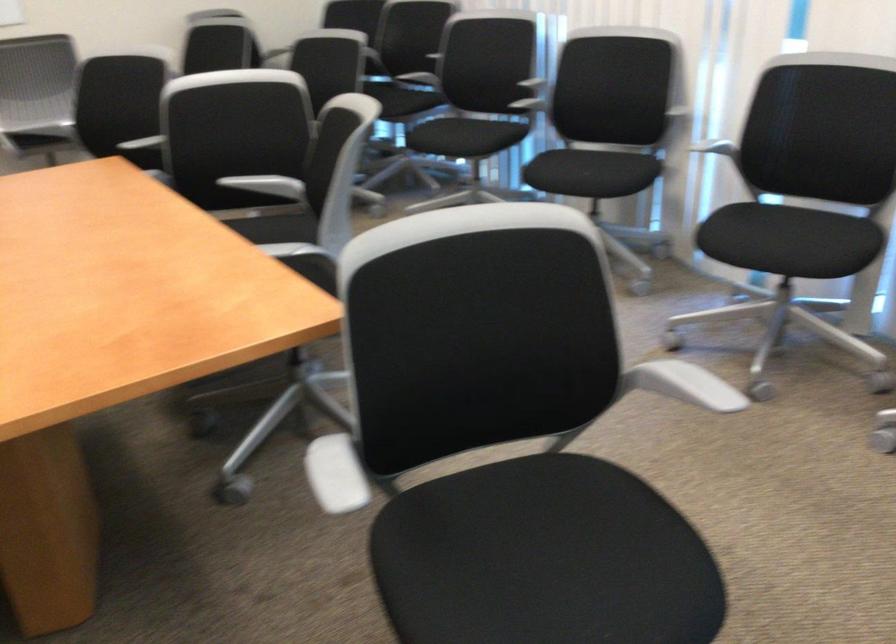
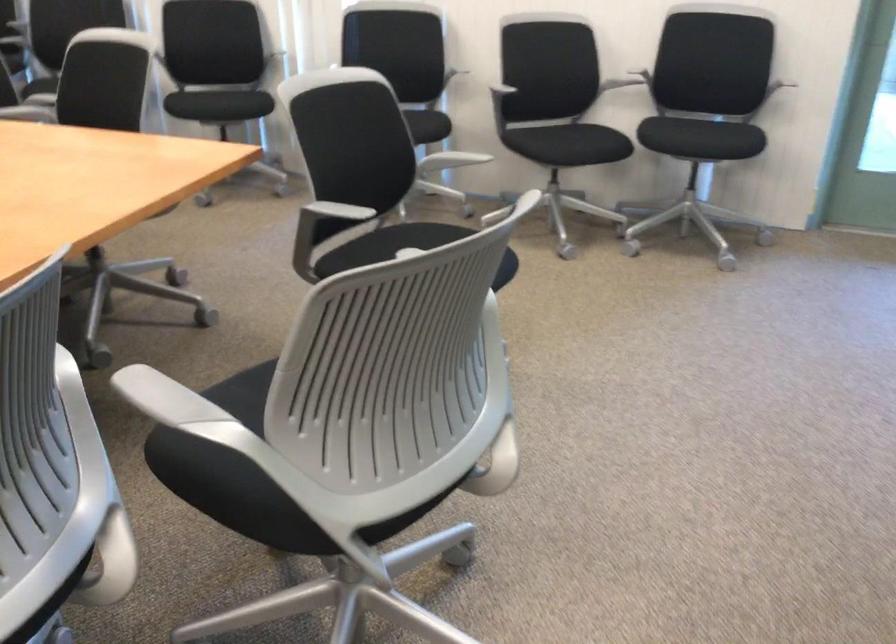
The point at (824, 261) is marked in the first image. Where is the corresponding point in the second image?

(426, 126)